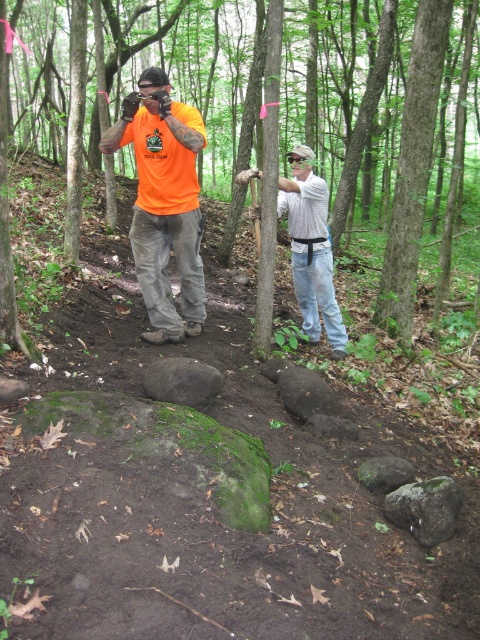
You are a hiker who needs to place a small marker between the gray rough rock at center and the green mossy rock at center. Which rock should you place the marker closer to if you want it to be farther from the wider rock?

The gray rough rock at center might be wider than green mossy rock at center. To place the marker farther from the wider rock, you should position it closer to the green mossy rock at center.